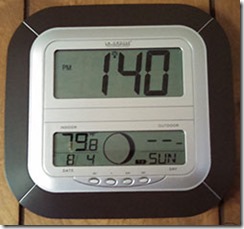
What are the coordinates of `wood paneling` in the screenshot? It's located at (8, 207).